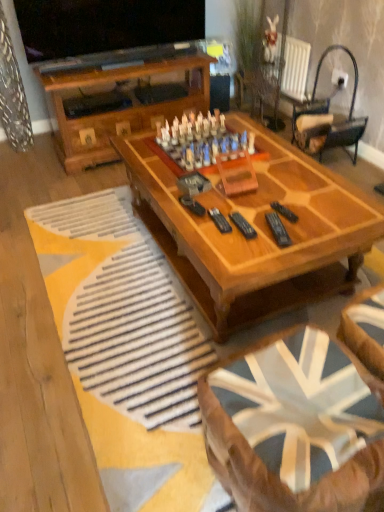
The width and height of the screenshot is (384, 512). What are the coordinates of `vacant space behind black plastic remote at center, marked as the 1th remote in a left-to-right arrangement` in the screenshot? It's located at (238, 203).